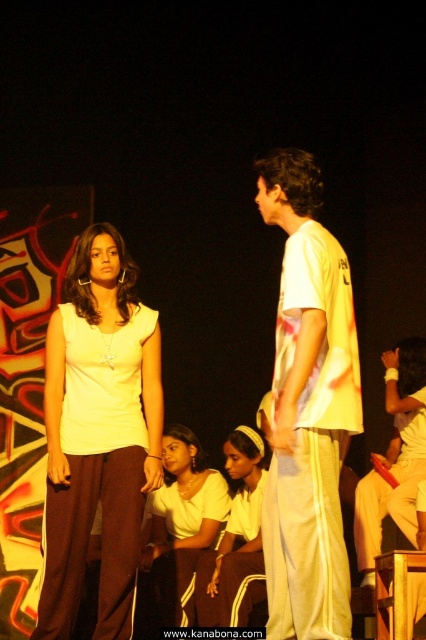
What do you see at coordinates (98, 433) in the screenshot? I see `matte white top at center` at bounding box center [98, 433].

Between matte white top at center and white fabric headband at center, which one has less height?

With less height is white fabric headband at center.

Is point (95, 298) in front of point (256, 490)?

Yes, point (95, 298) is in front of point (256, 490).

Identify the location of matte white top at center. This screenshot has height=640, width=426. pos(98,433).

Is point (123, 294) positioned behind point (307, 630)?

Yes, point (123, 294) is farther from viewer.

Does matte white top at center lie behind white printed t-shirt at center?

That is True.

Locate an element on the screen. The height and width of the screenshot is (640, 426). matte white top at center is located at coordinates (98, 433).

At what (x,y) coordinates should I click in order to perform the action: click on matte white top at center. Please return your answer as a coordinate pair (x, y). Looking at the image, I should click on (98, 433).

Where is `matte white blouse at center`? The height and width of the screenshot is (640, 426). matte white blouse at center is located at coordinates (176, 532).

Can you confirm if matte white blouse at center is wider than white fabric headband at center?

Yes, matte white blouse at center is wider than white fabric headband at center.

Does point (192, 460) come behind point (259, 544)?

Yes.

You are a GUI agent. You are given a task and a screenshot of the screen. Output one action in this format:
    pyautogui.click(x=<x>, y=<y>)
    Task: Click on the matte white blouse at center
    Image resolution: width=426 pixels, height=640 pixels.
    Given the screenshot: What is the action you would take?
    pyautogui.click(x=176, y=532)